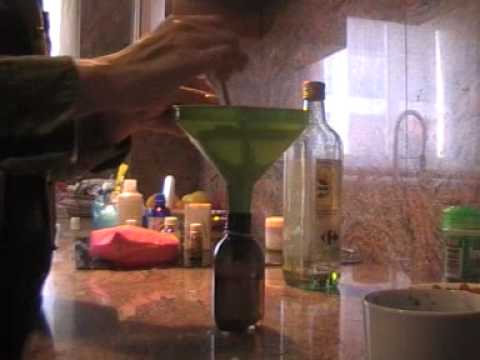
Where is `coutertop`? Image resolution: width=480 pixels, height=360 pixels. coutertop is located at coordinates (122, 322).